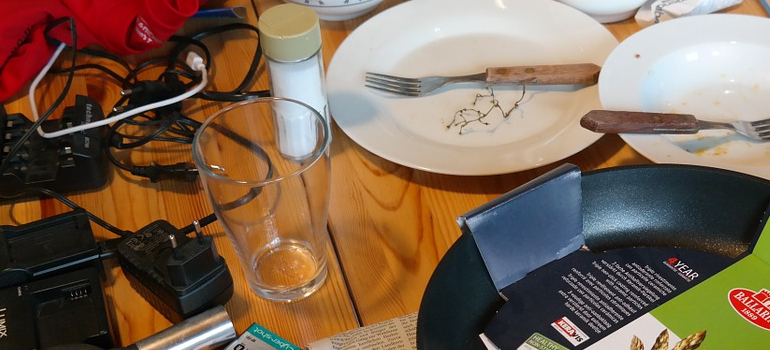
Where is `plug`? The height and width of the screenshot is (350, 770). plug is located at coordinates (196, 272).